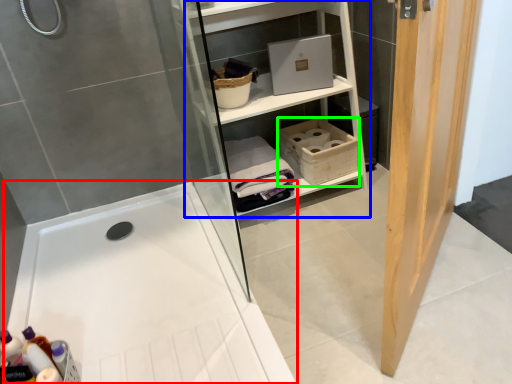
Question: Which object is positioned closest to bathtub (highlighted by a red box)? Select from shelf (highlighted by a blue box) and basket (highlighted by a green box).

Choices:
 (A) shelf
 (B) basket

Answer: (B)